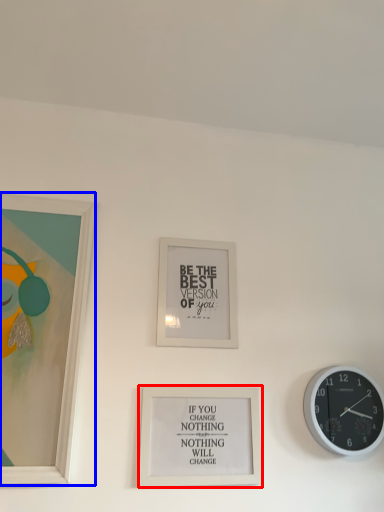
Question: Which object is further to the camera taking this photo, picture frame (highlighted by a red box) or picture frame (highlighted by a blue box)?

Choices:
 (A) picture frame
 (B) picture frame

Answer: (A)